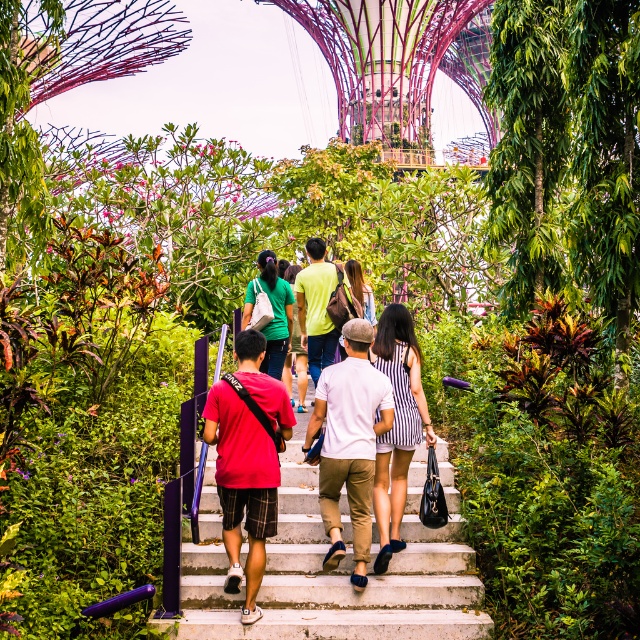
Based on the photo, is the position of concrete stairs at center more distant than that of white cotton shirt at center?

No, concrete stairs at center is closer to the viewer.

Describe the element at coordinates (336, 570) in the screenshot. This screenshot has width=640, height=640. I see `concrete stairs at center` at that location.

Where is `concrete stairs at center`? concrete stairs at center is located at coordinates (336, 570).

Is point (284, 428) closer to camera compared to point (365, 305)?

Yes.

Is matte red t-shirt at center closer to camera compared to denim jacket at center?

That is True.

This screenshot has height=640, width=640. Describe the element at coordinates (248, 461) in the screenshot. I see `matte red t-shirt at center` at that location.

At what (x,y) coordinates should I click in order to perform the action: click on matte red t-shirt at center. Please return your answer as a coordinate pair (x, y). The image size is (640, 640). Looking at the image, I should click on (248, 461).

Can you confirm if matte green shirt at center is bigger than denim jacket at center?

Correct, matte green shirt at center is larger in size than denim jacket at center.

Which is more to the left, matte green shirt at center or denim jacket at center?

From the viewer's perspective, matte green shirt at center appears more on the left side.

Where is `matte green shirt at center`? This screenshot has width=640, height=640. matte green shirt at center is located at coordinates (273, 310).

Identify the location of matte green shirt at center. (273, 310).